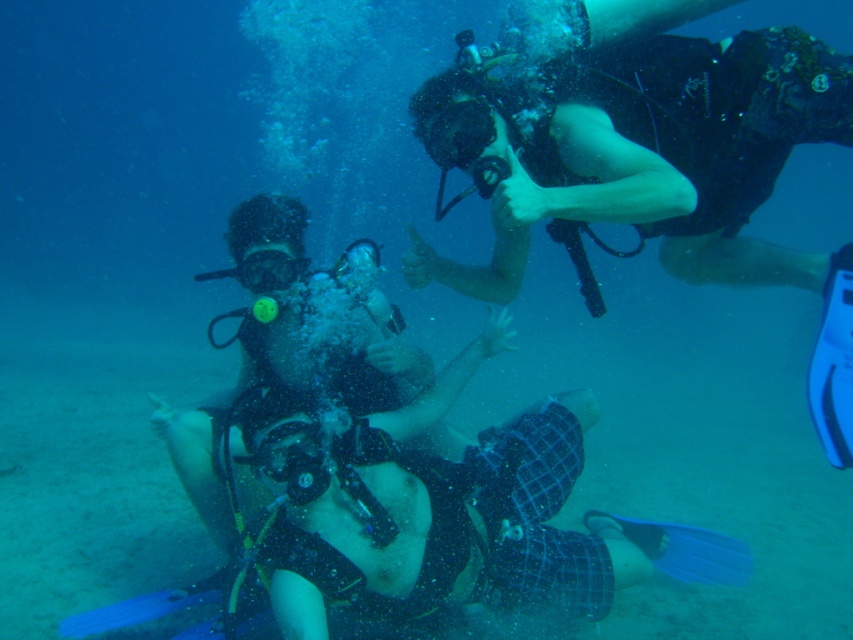
Who is more distant from viewer, (811,58) or (273,269)?

Positioned behind is point (273,269).

Find the location of `black matte scuba gear at upper center`. black matte scuba gear at upper center is located at coordinates (637, 154).